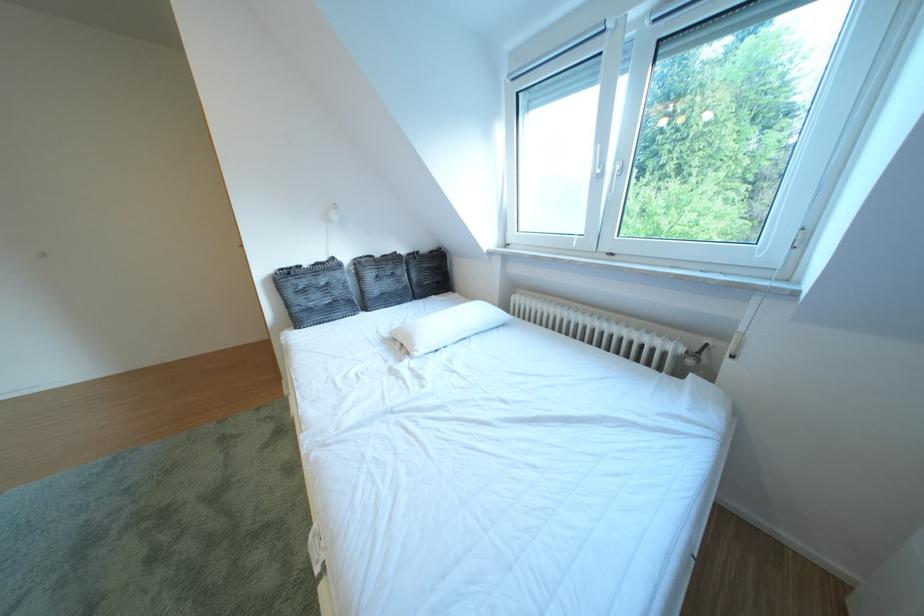
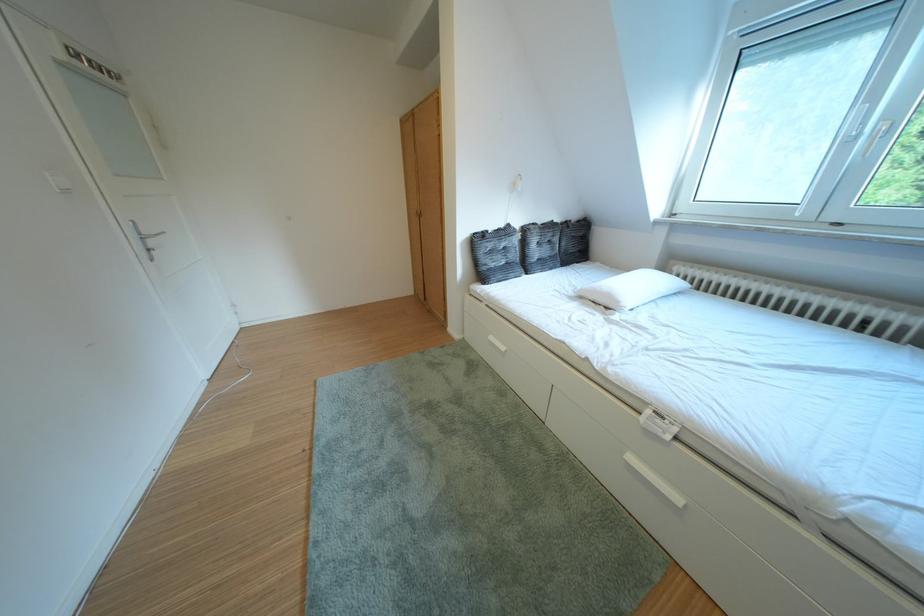
Locate, in the second image, the point that corresponds to (x=312, y=272) in the first image.

(500, 237)